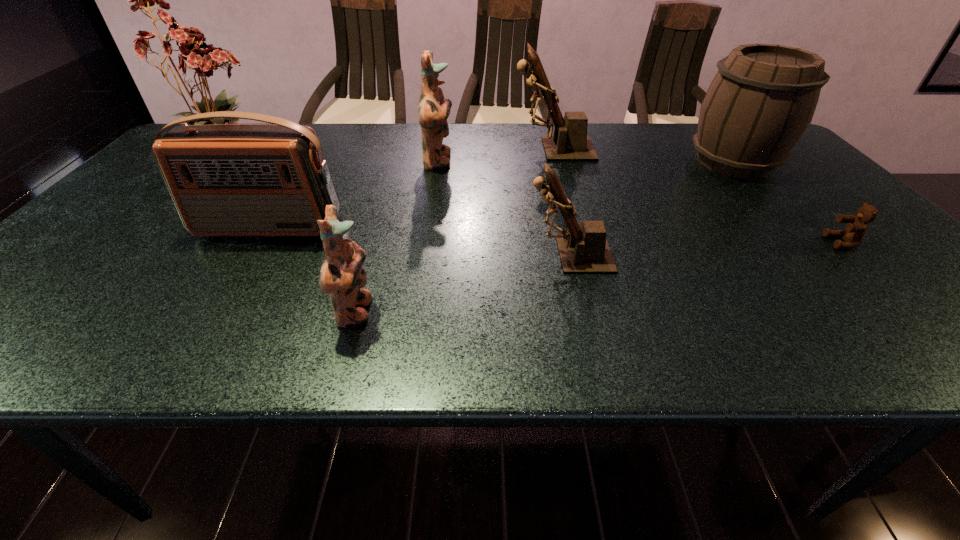
The width and height of the screenshot is (960, 540). In order to click on wine bucket that is positioned at the right edge in this screenshot , I will do `click(761, 101)`.

What are the coordinates of `teddy bear that is at the right edge` in the screenshot? It's located at (856, 228).

Find the location of `object present at the far left corner`. object present at the far left corner is located at coordinates (205, 60).

The width and height of the screenshot is (960, 540). I want to click on object located at the far right corner, so click(x=761, y=101).

In the image, there is a desktop. Identify the location of free region at the far edge. The height and width of the screenshot is (540, 960). (653, 152).

Where is `free location at the right edge of the desktop`? free location at the right edge of the desktop is located at coordinates (872, 293).

Image resolution: width=960 pixels, height=540 pixels. I want to click on blank area at the near right corner, so pos(919,320).

Image resolution: width=960 pixels, height=540 pixels. I want to click on unoccupied area between the leftmost figurine and the wine bucket, so click(x=544, y=237).

Where is `free space between the wine bucket and the bigger pink figurine`? Image resolution: width=960 pixels, height=540 pixels. free space between the wine bucket and the bigger pink figurine is located at coordinates (586, 162).

The image size is (960, 540). In order to click on free space between the brown wine bucket and the bigger pink figurine in this screenshot , I will do `click(586, 162)`.